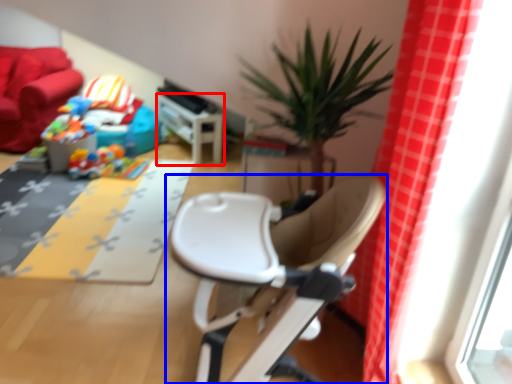
Question: Which object appears farthest to the camera in this image, table (highlighted by a red box) or chair (highlighted by a blue box)?

Choices:
 (A) table
 (B) chair

Answer: (A)